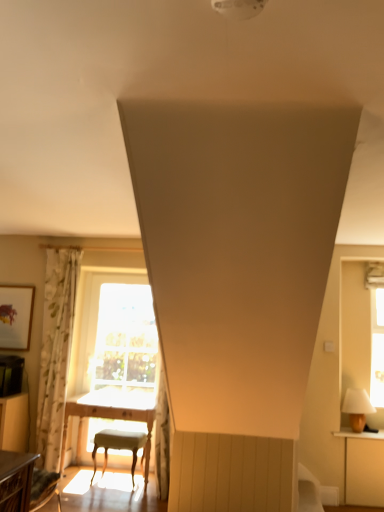
Question: From a real-world perspective, is light gray fabric stool at center on top of matte wooden picture frame at upper left?

Choices:
 (A) no
 (B) yes

Answer: (A)

Question: From the image's perspective, would you say light gray fabric stool at center is shown under matte wooden picture frame at upper left?

Choices:
 (A) yes
 (B) no

Answer: (A)

Question: Does light gray fabric stool at center have a greater width compared to matte wooden picture frame at upper left?

Choices:
 (A) yes
 (B) no

Answer: (A)

Question: From a real-world perspective, is light gray fabric stool at center below matte wooden picture frame at upper left?

Choices:
 (A) yes
 (B) no

Answer: (A)

Question: Is light gray fabric stool at center bigger than matte wooden picture frame at upper left?

Choices:
 (A) no
 (B) yes

Answer: (B)

Question: Would you say matte wooden picture frame at upper left is inside or outside light wood table at center, arranged as the 1th table when ordered from the bottom?

Choices:
 (A) inside
 (B) outside

Answer: (B)

Question: Considering the positions of point (8, 335) and point (66, 415), is point (8, 335) closer or farther from the camera than point (66, 415)?

Choices:
 (A) closer
 (B) farther

Answer: (B)

Question: From a real-world perspective, is matte wooden picture frame at upper left physically located above or below light wood table at center, the first table in the back-to-front sequence?

Choices:
 (A) below
 (B) above

Answer: (B)

Question: Is matte wooden picture frame at upper left taller or shorter than light wood table at center, the second table in the top-to-bottom sequence?

Choices:
 (A) tall
 (B) short

Answer: (B)

Question: Is matte white lampshade at right spatially inside floral fabric curtain at left, or outside of it?

Choices:
 (A) inside
 (B) outside

Answer: (B)

Question: Considering the positions of point (364, 403) and point (61, 333), is point (364, 403) closer or farther from the camera than point (61, 333)?

Choices:
 (A) farther
 (B) closer

Answer: (B)

Question: Is matte white lampshade at right taller or shorter than floral fabric curtain at left?

Choices:
 (A) short
 (B) tall

Answer: (A)

Question: Relative to floral fabric curtain at left, is matte white lampshade at right in front or behind?

Choices:
 (A) behind
 (B) front

Answer: (B)

Question: Considering the positions of matte wooden picture frame at upper left and matte white lampshade at right in the image, is matte wooden picture frame at upper left taller or shorter than matte white lampshade at right?

Choices:
 (A) tall
 (B) short

Answer: (A)

Question: From the image's perspective, is matte wooden picture frame at upper left positioned above or below matte white lampshade at right?

Choices:
 (A) above
 (B) below

Answer: (A)